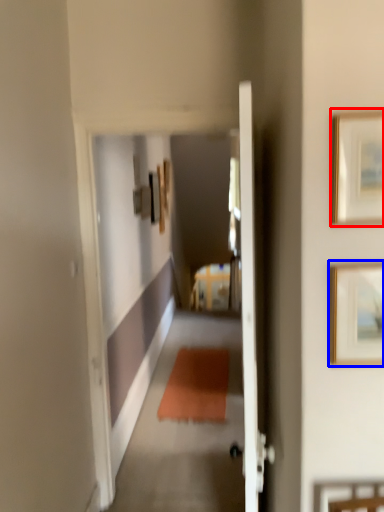
Question: Which object appears farthest to the camera in this image, picture frame (highlighted by a red box) or picture frame (highlighted by a blue box)?

Choices:
 (A) picture frame
 (B) picture frame

Answer: (B)